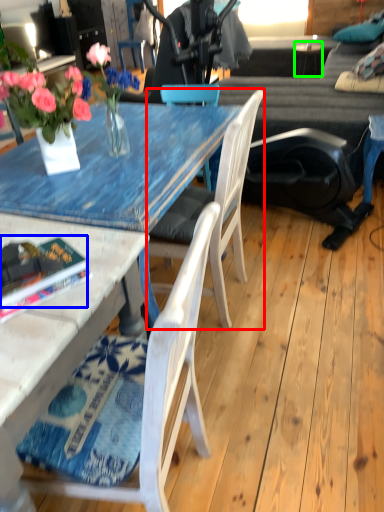
Question: Based on their relative distances, which object is nearer to chair (highlighted by a red box)? Choose from book (highlighted by a blue box) and side table (highlighted by a green box).

Choices:
 (A) book
 (B) side table

Answer: (A)